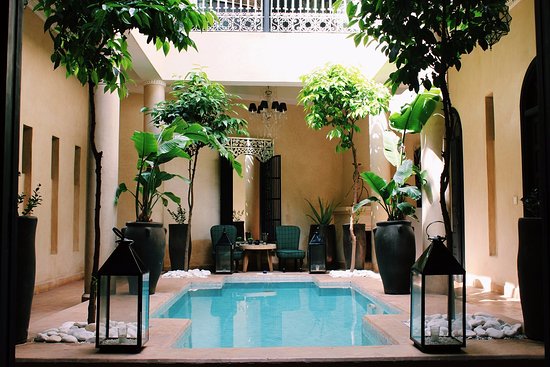
Locate an element on the screen. railing on the upper area on the left side is located at coordinates (243, 20).